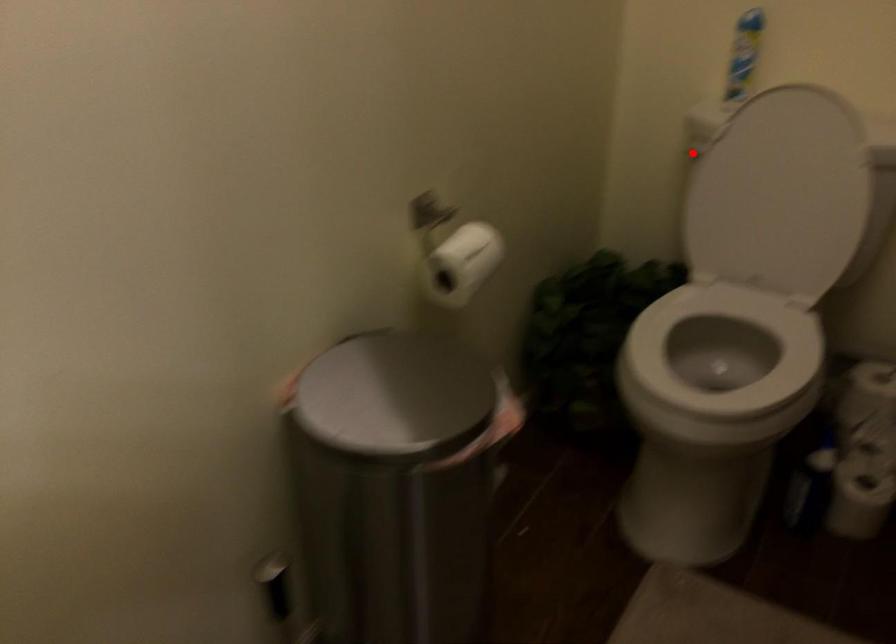
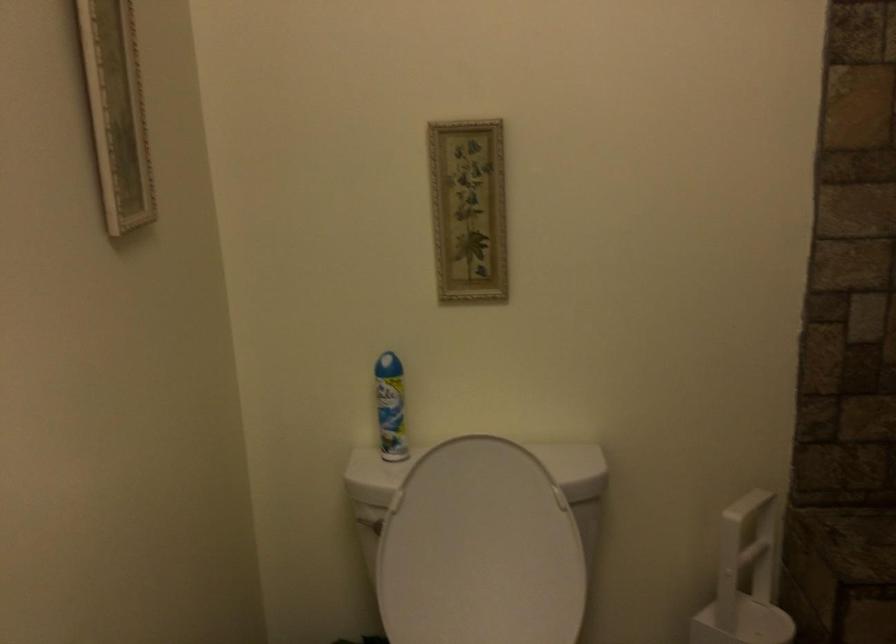
Locate, in the second image, the point that corresponds to the highlighted location in the first image.

(368, 522)